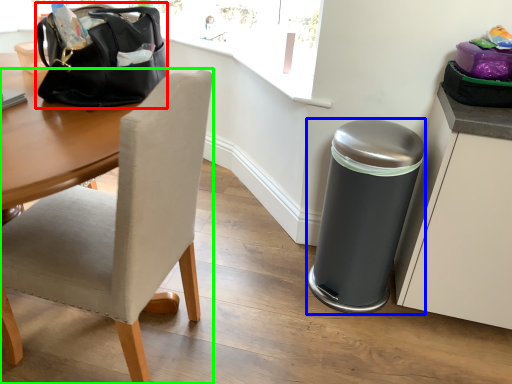
Question: Which is farther away from handbag (highlighted by a red box)? trash bin/can (highlighted by a blue box) or chair (highlighted by a green box)?

Choices:
 (A) trash bin/can
 (B) chair

Answer: (A)